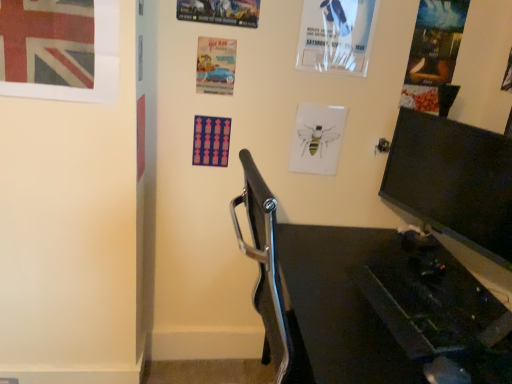
Question: From a real-world perspective, is blue glossy car at center, marked as the second poster page in a left-to-right arrangement, under union jack flag at upper left?

Choices:
 (A) no
 (B) yes

Answer: (B)

Question: From the image's perspective, is blue glossy car at center, the fifth poster page in the right-to-left sequence, located beneath union jack flag at upper left?

Choices:
 (A) yes
 (B) no

Answer: (A)

Question: Is blue glossy car at center, the fifth poster page in the right-to-left sequence, turned away from union jack flag at upper left?

Choices:
 (A) yes
 (B) no

Answer: (B)

Question: Is blue glossy car at center, marked as the second poster page in a left-to-right arrangement, positioned far away from union jack flag at upper left?

Choices:
 (A) no
 (B) yes

Answer: (A)

Question: Can you confirm if blue glossy car at center, marked as the second poster page in a left-to-right arrangement, is smaller than union jack flag at upper left?

Choices:
 (A) yes
 (B) no

Answer: (A)

Question: From a real-world perspective, is matte plastic poster at center, the first poster page when ordered from left to right, physically located above or below matte paper poster at upper right, the 6th poster page viewed from the left?

Choices:
 (A) above
 (B) below

Answer: (B)

Question: Visually, is matte plastic poster at center, the 6th poster page positioned from the right, positioned to the left or to the right of matte paper poster at upper right, which is counted as the first poster page, starting from the right?

Choices:
 (A) left
 (B) right

Answer: (A)

Question: Which is correct: matte plastic poster at center, the first poster page when ordered from left to right, is inside matte paper poster at upper right, which is counted as the first poster page, starting from the right, or outside of it?

Choices:
 (A) inside
 (B) outside

Answer: (B)

Question: Is point (203, 132) closer or farther from the camera than point (437, 41)?

Choices:
 (A) closer
 (B) farther

Answer: (B)

Question: From a real-world perspective, relative to union jack flag at upper left, is black glossy monitor at right vertically above or below?

Choices:
 (A) below
 (B) above

Answer: (A)

Question: Looking at the image, does black glossy monitor at right seem bigger or smaller compared to union jack flag at upper left?

Choices:
 (A) big
 (B) small

Answer: (A)

Question: Is point (442, 170) closer or farther from the camera than point (10, 59)?

Choices:
 (A) closer
 (B) farther

Answer: (B)

Question: Considering their positions, is black glossy monitor at right located in front of or behind union jack flag at upper left?

Choices:
 (A) front
 (B) behind

Answer: (A)

Question: Considering their positions, is white paper poster at upper center, acting as the second poster page starting from the right, located in front of or behind matte paper poster at upper right, which is counted as the first poster page, starting from the right?

Choices:
 (A) front
 (B) behind

Answer: (A)

Question: Is white paper poster at upper center, the 5th poster page from the left, to the left or to the right of matte paper poster at upper right, which is counted as the first poster page, starting from the right, in the image?

Choices:
 (A) left
 (B) right

Answer: (A)